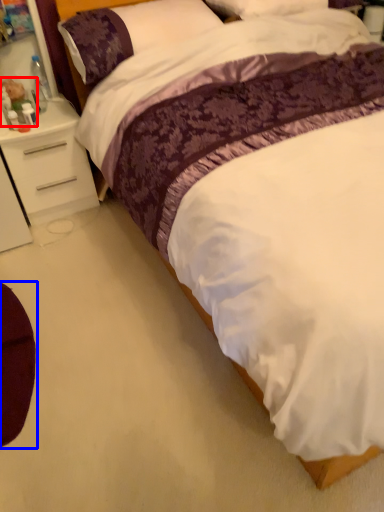
Question: Which of the following is the farthest to the observer, toy (highlighted by a red box) or swivel chair (highlighted by a blue box)?

Choices:
 (A) toy
 (B) swivel chair

Answer: (A)